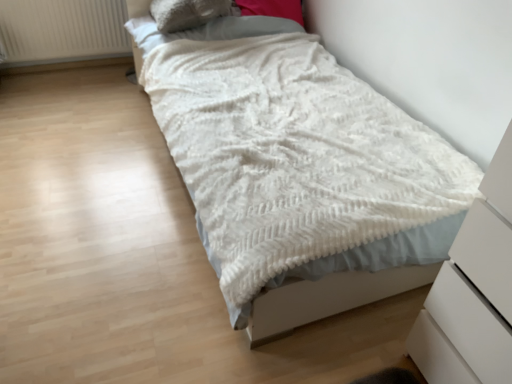
Locate an element on the screen. This screenshot has width=512, height=384. vacant space situated on the left part of white textured blanket at center is located at coordinates (83, 155).